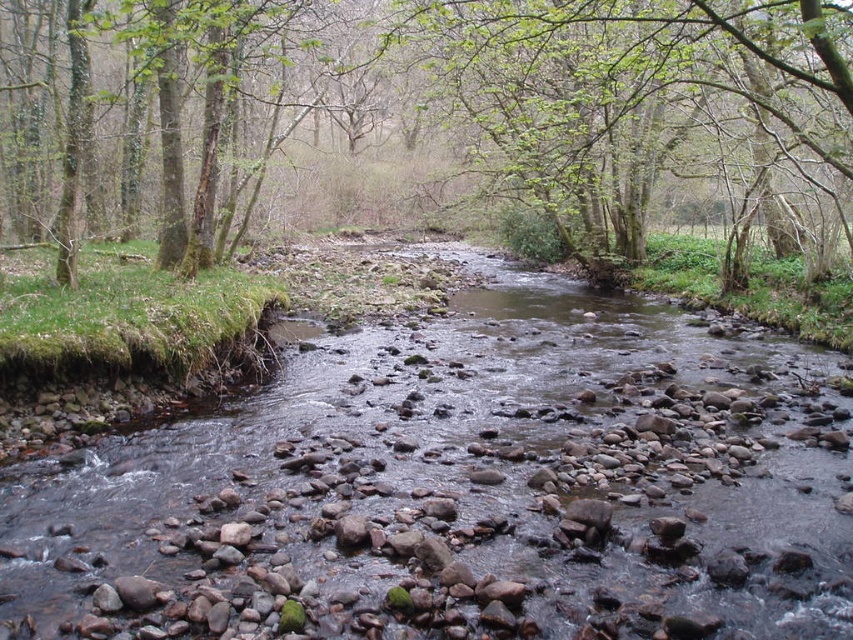
You are a hiker who wants to cross the stream safely. You see the smooth rock stream at center and the green mossy tree at center. Which object should you step on to avoid getting wet?

The smooth rock stream at center is below the green mossy tree at center, so stepping on the green mossy tree at center would keep you dry. However, since the tree is part of the bank, it might not be stable. The rocks in the stream are the intended path but they are in the water. The question might need rephrasing for clarity.

Looking at this image, you are a hiker who wants to cross the stream. You see the smooth rock stream at center and the green mossy tree at center. Which one is closer to the ground?

The smooth rock stream at center is shorter than the green mossy tree at center, so the smooth rock stream at center is closer to the ground.